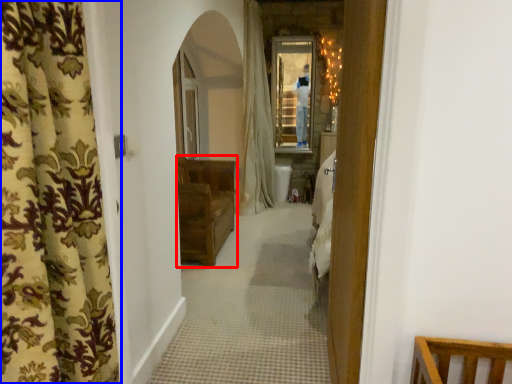
Question: Which point is closer to the camera, furniture (highlighted by a red box) or curtain (highlighted by a blue box)?

Choices:
 (A) furniture
 (B) curtain

Answer: (B)